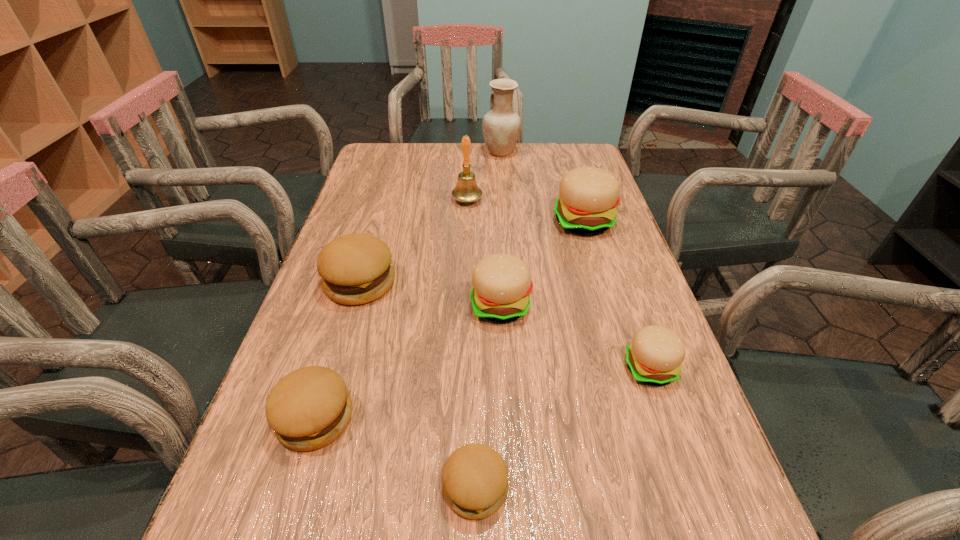
The height and width of the screenshot is (540, 960). I want to click on free spot between the smallest beige hamburger and the farthest object, so click(575, 260).

Find the location of a particular element. This screenshot has width=960, height=540. free area in between the smallest beige hamburger and the farthest brown hamburger is located at coordinates (505, 326).

This screenshot has width=960, height=540. Find the location of `empty space that is in between the leftmost beige hamburger and the rightmost brown hamburger`. empty space that is in between the leftmost beige hamburger and the rightmost brown hamburger is located at coordinates (489, 396).

The width and height of the screenshot is (960, 540). In order to click on free space between the second smallest beige hamburger and the smallest beige hamburger in this screenshot , I will do `click(575, 337)`.

You are a GUI agent. You are given a task and a screenshot of the screen. Output one action in this format:
    pyautogui.click(x=<x>, y=<y>)
    Task: Click on the vacant area that lies between the bell and the leftmost beige hamburger
    This screenshot has width=960, height=540.
    Given the screenshot: What is the action you would take?
    484,253

I want to click on vacant region between the second farthest beige hamburger and the smallest beige hamburger, so click(x=575, y=337).

Point out which object is positioned as the nearest to the nearest object. Please provide its 2D coordinates. Your answer should be formatted as a tuple, i.e. [(x, y)], where the tuple contains the x and y coordinates of a point satisfying the conditions above.

[(309, 408)]

Image resolution: width=960 pixels, height=540 pixels. I want to click on the fifth closest object relative to the leftmost beige hamburger, so click(x=475, y=478).

Select which hamburger appears as the third closest to the nearest brown hamburger. Please provide its 2D coordinates. Your answer should be formatted as a tuple, i.e. [(x, y)], where the tuple contains the x and y coordinates of a point satisfying the conditions above.

[(502, 284)]

Select which hamburger is the closest to the smallest beige hamburger. Please provide its 2D coordinates. Your answer should be formatted as a tuple, i.e. [(x, y)], where the tuple contains the x and y coordinates of a point satisfying the conditions above.

[(502, 284)]